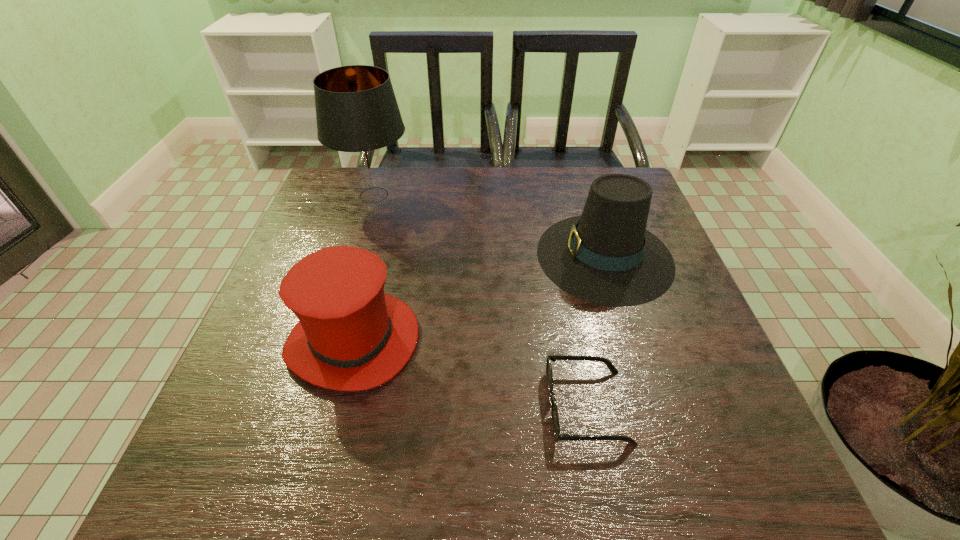
This screenshot has width=960, height=540. Identify the location of the tallest object. (357, 114).

Find the location of a particular element. the right hat is located at coordinates (606, 256).

Find the location of a particular element. the left hat is located at coordinates (351, 336).

Identify the location of the shortest object. This screenshot has height=540, width=960. (554, 412).

Find the location of `free point located on the right of the tallest object`. free point located on the right of the tallest object is located at coordinates (430, 195).

I want to click on free spot located 0.180m on the front-facing side of the right hat, so click(464, 256).

You are a GUI agent. You are given a task and a screenshot of the screen. Output one action in this format:
    pyautogui.click(x=<x>, y=<y>)
    Task: Click on the vacant space located on the front-facing side of the right hat
    This screenshot has width=960, height=540.
    Given the screenshot: What is the action you would take?
    click(516, 256)

Where is `free space located on the front-facing side of the right hat`? This screenshot has height=540, width=960. free space located on the front-facing side of the right hat is located at coordinates (476, 256).

This screenshot has height=540, width=960. I want to click on free location located on the front of the left hat, so click(x=328, y=439).

Where is `free location located 0.280m on the front-facing side of the shortest object`? This screenshot has width=960, height=540. free location located 0.280m on the front-facing side of the shortest object is located at coordinates (390, 406).